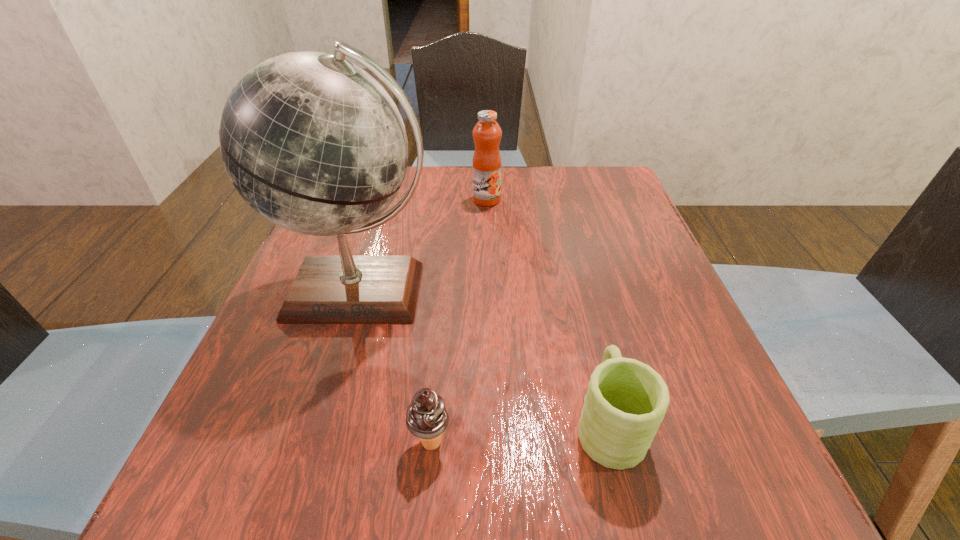
At what (x,y) coordinates should I click in order to perform the action: click on the third nearest object. Please return your answer as a coordinate pair (x, y). Image resolution: width=960 pixels, height=540 pixels. Looking at the image, I should click on (314, 144).

The image size is (960, 540). In order to click on globe in this screenshot , I will do `click(314, 144)`.

Image resolution: width=960 pixels, height=540 pixels. What are the coordinates of `the farthest object` in the screenshot? It's located at (486, 164).

This screenshot has height=540, width=960. Find the location of `the second object from right to left`. the second object from right to left is located at coordinates (x=486, y=164).

Where is `icecream`? The height and width of the screenshot is (540, 960). icecream is located at coordinates (426, 417).

I want to click on mug, so click(626, 400).

What are the coordinates of `free location located at the equator of the third nearest object` in the screenshot? It's located at (320, 429).

You are a GUI agent. You are given a task and a screenshot of the screen. Output one action in this format:
    pyautogui.click(x=<x>, y=<y>)
    Task: Click on the vacant point located on the front label of the fruit juice
    This screenshot has height=540, width=960.
    Given the screenshot: What is the action you would take?
    pyautogui.click(x=489, y=273)

In order to click on vacant space situated on the back of the icecream in this screenshot , I will do `click(440, 344)`.

You are a GUI agent. You are given a task and a screenshot of the screen. Output one action in this format:
    pyautogui.click(x=<x>, y=<y>)
    Task: Click on the blank space located on the side of the rightmost object with the handle
    
    Given the screenshot: What is the action you would take?
    pyautogui.click(x=580, y=307)